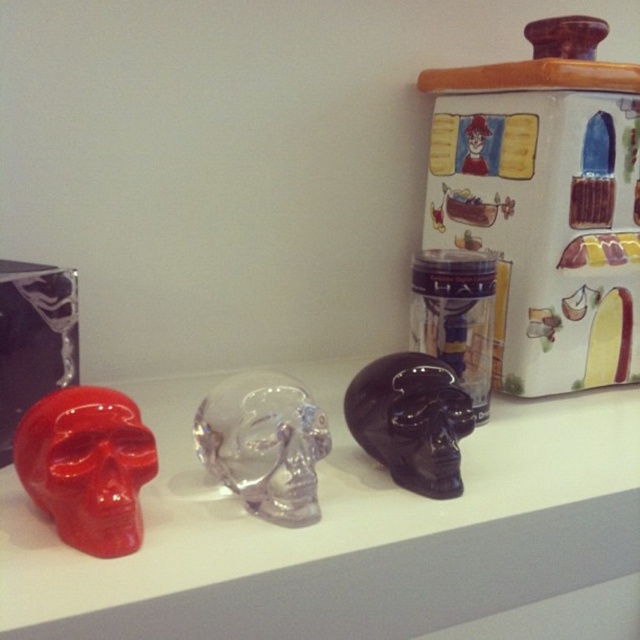
Question: Estimate the real-world distances between objects in this image. Which object is closer to the matte ceramic jar at upper right?

Choices:
 (A) glossy black skull at center
 (B) matte red skull at left
 (C) matte glass skull at center

Answer: (C)

Question: Considering the real-world distances, which object is closest to the matte ceramic jar at upper right?

Choices:
 (A) transparent glass skull at center
 (B) matte red skull at left
 (C) glossy black skull at center
 (D) matte glass skull at center

Answer: (D)

Question: Is transparent glass skull at center above glossy black skull at center?

Choices:
 (A) yes
 (B) no

Answer: (B)

Question: Can you confirm if matte glass skull at center is positioned below glossy black skull at center?

Choices:
 (A) no
 (B) yes

Answer: (B)

Question: From the image, what is the correct spatial relationship of matte ceramic jar at upper right in relation to glossy black skull at center?

Choices:
 (A) right
 (B) left

Answer: (A)

Question: Among these points, which one is farthest from the camera?

Choices:
 (A) (401, 392)
 (B) (600, 282)
 (C) (195, 417)

Answer: (B)